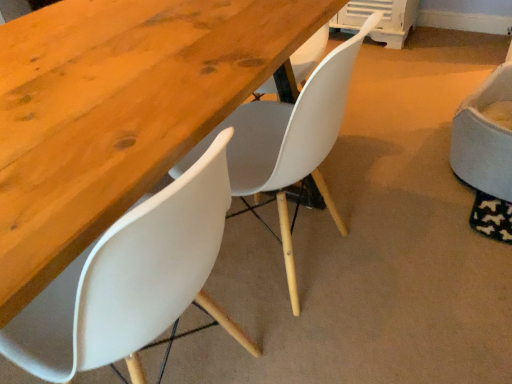
The image size is (512, 384). Identify the location of white matte chair at center, which ranks as the second chair in right-to-left order. (288, 140).

In order to click on white matte chair at center, which ranks as the second chair in right-to-left order in this screenshot , I will do `click(288, 140)`.

Considering the sizes of white plastic chair at lower left, the first chair positioned from the left, and wooden table at center in the image, is white plastic chair at lower left, the first chair positioned from the left, wider or thinner than wooden table at center?

Clearly, white plastic chair at lower left, the first chair positioned from the left, has less width compared to wooden table at center.

Is white plastic chair at lower left, the 3th chair viewed from the right, aimed at wooden table at center?

Yes, white plastic chair at lower left, the 3th chair viewed from the right, is oriented towards wooden table at center.

Which is behind, white plastic chair at lower left, the first chair positioned from the left, or wooden table at center?

wooden table at center is further from the camera.

Considering the relative positions of white plastic chair at lower left, the 3th chair viewed from the right, and wooden table at center in the image provided, is white plastic chair at lower left, the 3th chair viewed from the right, to the right of wooden table at center from the viewer's perspective?

Correct, you'll find white plastic chair at lower left, the 3th chair viewed from the right, to the right of wooden table at center.

Between white fabric chair at right, which appears as the 1th chair when viewed from the right, and white matte chair at center, which ranks as the second chair in right-to-left order, which one appears on the left side from the viewer's perspective?

white matte chair at center, which ranks as the second chair in right-to-left order, is more to the left.

Is point (456, 169) less distant than point (234, 188)?

No.

I want to click on chair located on the right of white matte chair at center, the second chair viewed from the left, so click(x=484, y=138).

From a real-world perspective, is white fabric chair at right, which appears as the 1th chair when viewed from the right, above or below white matte chair at center, which ranks as the second chair in right-to-left order?

From a real-world perspective, white fabric chair at right, which appears as the 1th chair when viewed from the right, is physically below white matte chair at center, which ranks as the second chair in right-to-left order.

There is a wooden table at center. Where is `the 2nd chair above it (from a real-world perspective)`? the 2nd chair above it (from a real-world perspective) is located at coordinates (131, 280).

From a real-world perspective, relative to white plastic chair at lower left, the first chair positioned from the left, is wooden table at center vertically above or below?

In terms of real-world spatial position, wooden table at center is below white plastic chair at lower left, the first chair positioned from the left.

Who is bigger, wooden table at center or white plastic chair at lower left, the first chair positioned from the left?

With larger size is wooden table at center.

Which is correct: wooden table at center is inside white plastic chair at lower left, the 3th chair viewed from the right, or outside of it?

wooden table at center cannot be found inside white plastic chair at lower left, the 3th chair viewed from the right.

From the image's perspective, which one is positioned lower, white plastic chair at lower left, the first chair positioned from the left, or white fabric chair at right, which is the 3th chair from left to right?

white plastic chair at lower left, the first chair positioned from the left, is shown below in the image.

How far apart are white plastic chair at lower left, the first chair positioned from the left, and white fabric chair at right, which appears as the 1th chair when viewed from the right?

white plastic chair at lower left, the first chair positioned from the left, is 1.33 meters from white fabric chair at right, which appears as the 1th chair when viewed from the right.

Is white plastic chair at lower left, the first chair positioned from the left, to the left of white fabric chair at right, which appears as the 1th chair when viewed from the right, from the viewer's perspective?

Yes, white plastic chair at lower left, the first chair positioned from the left, is to the left of white fabric chair at right, which appears as the 1th chair when viewed from the right.

Considering the sizes of objects white plastic chair at lower left, the 3th chair viewed from the right, and white fabric chair at right, which appears as the 1th chair when viewed from the right, in the image provided, who is taller, white plastic chair at lower left, the 3th chair viewed from the right, or white fabric chair at right, which appears as the 1th chair when viewed from the right,?

Standing taller between the two is white plastic chair at lower left, the 3th chair viewed from the right.

Looking at this image, is white fabric chair at right, which is the 3th chair from left to right, to the left of white plastic chair at lower left, the first chair positioned from the left, from the viewer's perspective?

Incorrect, white fabric chair at right, which is the 3th chair from left to right, is not on the left side of white plastic chair at lower left, the first chair positioned from the left.

Which object is more forward, white fabric chair at right, which is the 3th chair from left to right, or white plastic chair at lower left, the 3th chair viewed from the right?

white plastic chair at lower left, the 3th chair viewed from the right, is more forward.

From a real-world perspective, is white fabric chair at right, which appears as the 1th chair when viewed from the right, over white plastic chair at lower left, the first chair positioned from the left?

No, from a real-world perspective, white fabric chair at right, which appears as the 1th chair when viewed from the right, is not above white plastic chair at lower left, the first chair positioned from the left.

Does white fabric chair at right, which appears as the 1th chair when viewed from the right, contain white plastic chair at lower left, the first chair positioned from the left?

No, white plastic chair at lower left, the first chair positioned from the left, is not a part of white fabric chair at right, which appears as the 1th chair when viewed from the right.

Considering the sizes of objects white fabric chair at right, which is the 3th chair from left to right, and wooden table at center in the image provided, who is thinner, white fabric chair at right, which is the 3th chair from left to right, or wooden table at center?

white fabric chair at right, which is the 3th chair from left to right, is thinner.

Between white fabric chair at right, which appears as the 1th chair when viewed from the right, and wooden table at center, which one is positioned behind?

white fabric chair at right, which appears as the 1th chair when viewed from the right.

From a real-world perspective, relative to wooden table at center, is white fabric chair at right, which appears as the 1th chair when viewed from the right, vertically above or below?

white fabric chair at right, which appears as the 1th chair when viewed from the right, is situated lower than wooden table at center in the real world.

Does point (476, 168) come in front of point (67, 94)?

No.

Considering the relative sizes of wooden table at center and white fabric chair at right, which appears as the 1th chair when viewed from the right, in the image provided, is wooden table at center smaller than white fabric chair at right, which appears as the 1th chair when viewed from the right,?

Incorrect, wooden table at center is not smaller in size than white fabric chair at right, which appears as the 1th chair when viewed from the right.

Is wooden table at center oriented towards white fabric chair at right, which appears as the 1th chair when viewed from the right?

No, wooden table at center does not turn towards white fabric chair at right, which appears as the 1th chair when viewed from the right.

How many degrees apart are the facing directions of wooden table at center and white fabric chair at right, which is the 3th chair from left to right?

The angle between the facing direction of wooden table at center and the facing direction of white fabric chair at right, which is the 3th chair from left to right, is 176 degrees.

Looking at this image, considering the relative positions of wooden table at center and white fabric chair at right, which is the 3th chair from left to right, in the image provided, is wooden table at center to the left or to the right of white fabric chair at right, which is the 3th chair from left to right,?

wooden table at center is to the left of white fabric chair at right, which is the 3th chair from left to right.

Locate an element on the screen. Image resolution: width=512 pixels, height=384 pixels. chair that is in front of the wooden table at center is located at coordinates (131, 280).

At what (x,y) coordinates should I click in order to perform the action: click on chair on the right of the white matte chair at center, which ranks as the second chair in right-to-left order. Please return your answer as a coordinate pair (x, y). The image size is (512, 384). Looking at the image, I should click on (484, 138).

Based on the photo, looking at the image, which one is located further to white plastic chair at lower left, the 3th chair viewed from the right, white fabric chair at right, which appears as the 1th chair when viewed from the right, or wooden table at center?

white fabric chair at right, which appears as the 1th chair when viewed from the right, is positioned further to the anchor white plastic chair at lower left, the 3th chair viewed from the right.

Which object lies further to the anchor point white fabric chair at right, which appears as the 1th chair when viewed from the right, white matte chair at center, which ranks as the second chair in right-to-left order, or white plastic chair at lower left, the first chair positioned from the left?

white plastic chair at lower left, the first chair positioned from the left.

From the image, which object appears to be nearer to white matte chair at center, which ranks as the second chair in right-to-left order, white plastic chair at lower left, the 3th chair viewed from the right, or white fabric chair at right, which appears as the 1th chair when viewed from the right?

white plastic chair at lower left, the 3th chair viewed from the right, is positioned closer to the anchor white matte chair at center, which ranks as the second chair in right-to-left order.

From the image, which object appears to be farther from white plastic chair at lower left, the first chair positioned from the left, wooden table at center or white fabric chair at right, which is the 3th chair from left to right?

Among the two, white fabric chair at right, which is the 3th chair from left to right, is located further to white plastic chair at lower left, the first chair positioned from the left.

From the image, which object appears to be nearer to wooden table at center, white plastic chair at lower left, the first chair positioned from the left, or white matte chair at center, which ranks as the second chair in right-to-left order?

white plastic chair at lower left, the first chair positioned from the left.

Looking at the image, which one is located further to white matte chair at center, which ranks as the second chair in right-to-left order, wooden table at center or white fabric chair at right, which appears as the 1th chair when viewed from the right?

Based on the image, white fabric chair at right, which appears as the 1th chair when viewed from the right, appears to be further to white matte chair at center, which ranks as the second chair in right-to-left order.

Based on the photo, which object lies further to the anchor point white matte chair at center, which ranks as the second chair in right-to-left order, wooden table at center or white plastic chair at lower left, the 3th chair viewed from the right?

Among the two, white plastic chair at lower left, the 3th chair viewed from the right, is located further to white matte chair at center, which ranks as the second chair in right-to-left order.

Considering their positions, is white plastic chair at lower left, the 3th chair viewed from the right, positioned further to white fabric chair at right, which appears as the 1th chair when viewed from the right, than wooden table at center?

white plastic chair at lower left, the 3th chair viewed from the right, is positioned further to the anchor white fabric chair at right, which appears as the 1th chair when viewed from the right.

Image resolution: width=512 pixels, height=384 pixels. In order to click on chair between wooden table at center and white matte chair at center, which ranks as the second chair in right-to-left order in this screenshot , I will do `click(131, 280)`.

The width and height of the screenshot is (512, 384). Identify the location of chair between white plastic chair at lower left, the 3th chair viewed from the right, and white fabric chair at right, which appears as the 1th chair when viewed from the right. (288, 140).